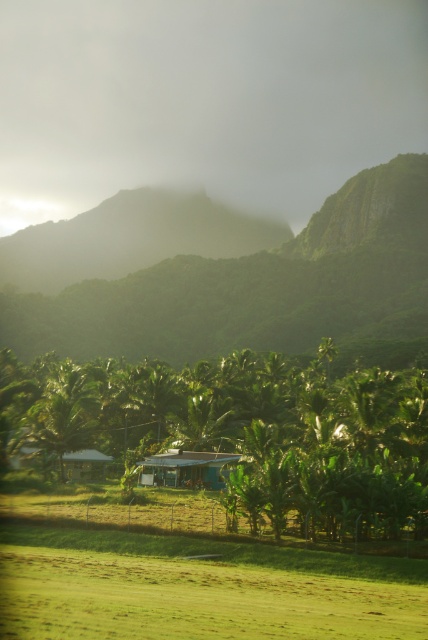
You are an environmental scientist planning to install a weather station between the green leafy tree at lower center and the green leafy mountain at upper center. The station requires a minimum of 100 meters of space to ensure accurate readings. Can the available distance accommodate this requirement?

The distance between the green leafy tree at lower center and the green leafy mountain at upper center is 106.07 meters, which exceeds the required 100 meters. Therefore, the weather station can be installed in this location to meet the space requirement.

You are standing in the tropical landscape and want to take a photo of both the green leafy mountain at upper center and the green corrugated metal hut at center. Which object should you position to your left to capture both in the frame?

You should position the green corrugated metal hut at center to your left since the green leafy mountain at upper center is to the right of it, allowing both to be captured in the frame.

You are a drone operator trying to capture aerial footage of the tropical landscape. You have two points marked on your screen, point 1 at coordinates point (202, 330) and point 2 at coordinates point (71, 451). Which point is closer to your camera lens?

Point (71, 451) is closer to the camera lens because it is less further away compared to point (202, 330), which is further to the viewer.